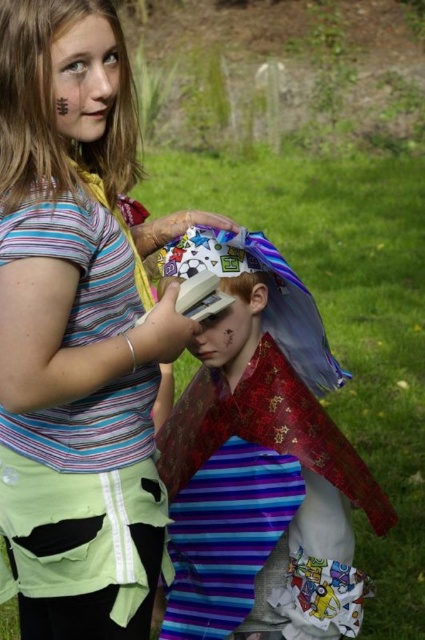
You are a fashion designer who wants to create a new outfit combining the striped fabric dress at center and the shiny metallic helmet at center. Which item should you place first in your design to ensure proper fit and visibility?

Since the striped fabric dress at center is narrower than the shiny metallic helmet at center, you should place the shiny metallic helmet at center first to ensure it doesn not obstruct the dress and maintains visibility.